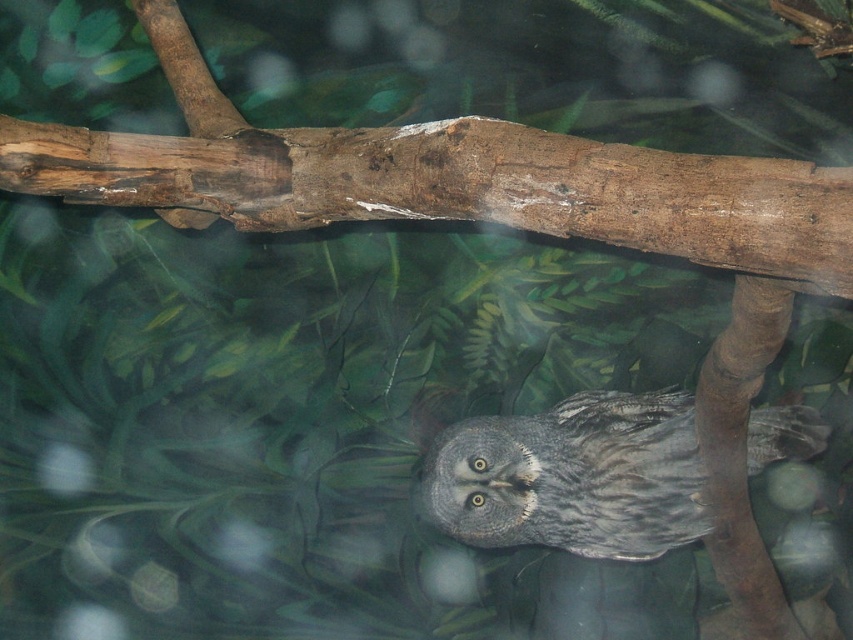
You are a photographer trying to capture the owl in the zoo exhibit. You notice two points in the image at coordinates point (650,184) and point (575,403). Which point is nearer to your camera lens?

Point (650,184) is closer to the camera than point (575,403).

You are an animal keeper at the zoo and need to place a new feeding tray for the owl. The feeding tray must be placed exactly at the same 2D location as the brown rough wood at upper center. What are the coordinates where you should place the feeding tray?

The coordinates for the brown rough wood at upper center are at point (440, 179), so you should place the feeding tray at those coordinates.